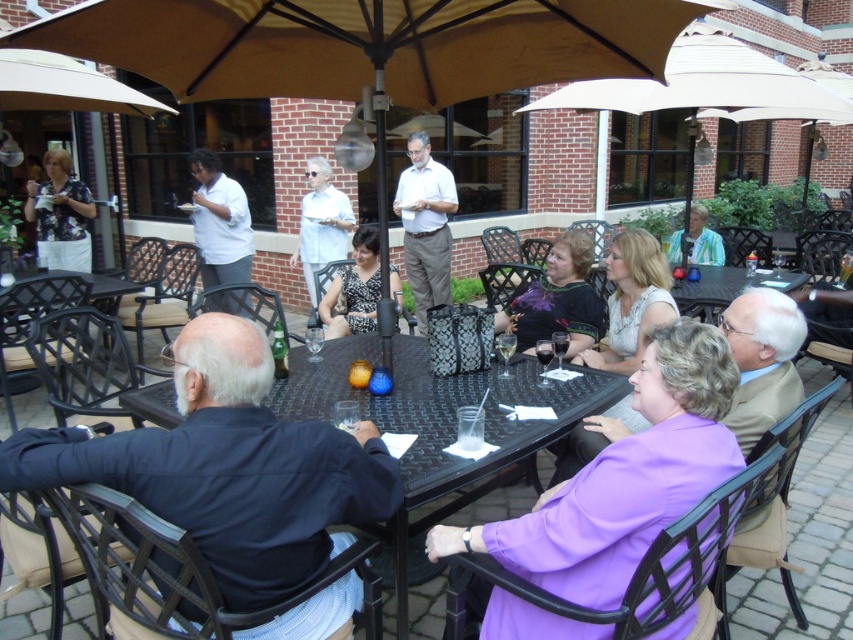
Does purple fabric jacket at center have a greater height compared to matte white shirt at center?

No, purple fabric jacket at center is not taller than matte white shirt at center.

Is purple fabric jacket at center below matte white shirt at center?

Yes.

Does point (569, 497) come in front of point (222, 301)?

Yes.

I want to click on purple fabric jacket at center, so click(624, 477).

Is light brown pants at center wider than striped shirt at center?

Incorrect, light brown pants at center's width does not surpass striped shirt at center's.

Is point (425, 321) closer to camera compared to point (697, 224)?

No, it is behind (697, 224).

Does point (424, 257) lie in front of point (695, 218)?

No, it is not.

Locate an element on the screen. This screenshot has height=640, width=853. light brown pants at center is located at coordinates (425, 225).

Between point (717, 38) and point (566, 273), which one is positioned in front?

Point (566, 273)

Is beige fabric umbrella at upper center taller than black textured dress at center?

Yes.

At what (x,y) coordinates should I click in order to perform the action: click on beige fabric umbrella at upper center. Please return your answer as a coordinate pair (x, y). Looking at the image, I should click on (706, 88).